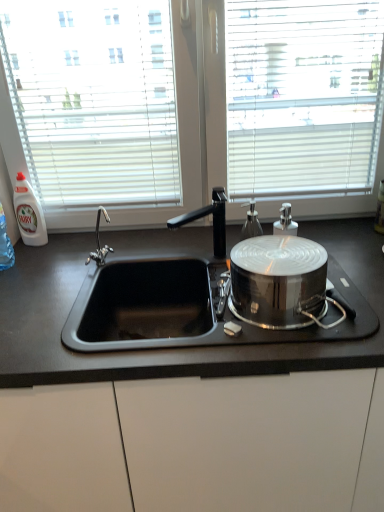
I want to click on free space above polished stainless steel pot at right (from a real-world perspective), so click(291, 258).